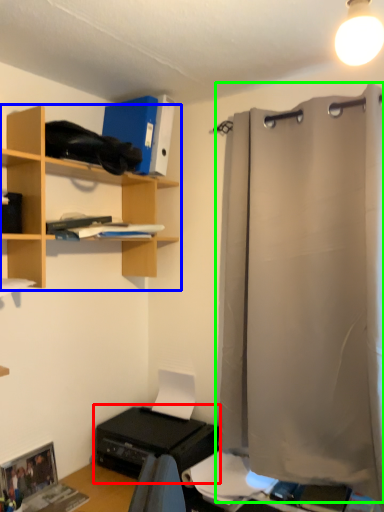
Question: Which object is the closest to the printer (highlighted by a red box)? Choose among these: shelf (highlighted by a blue box) or shower curtain (highlighted by a green box).

Choices:
 (A) shelf
 (B) shower curtain

Answer: (B)